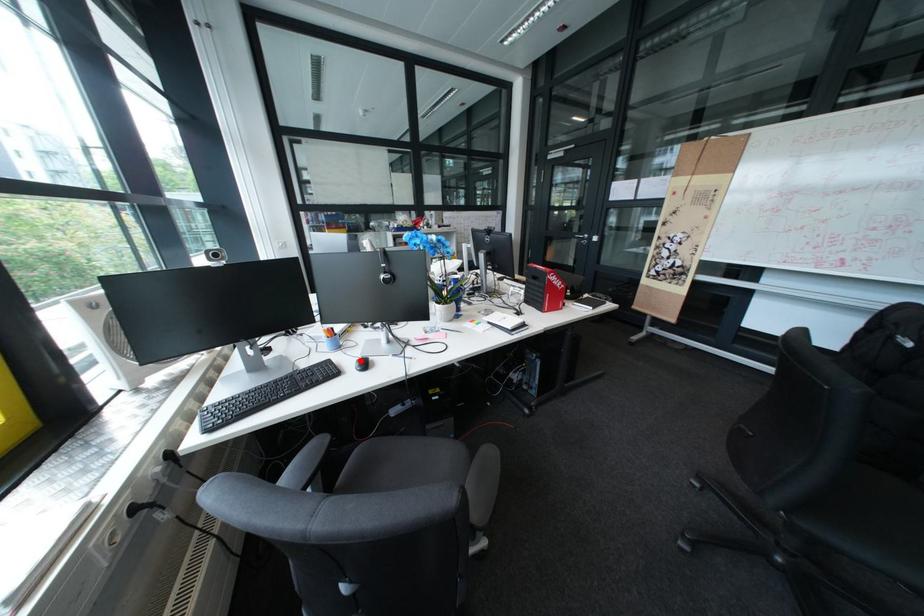
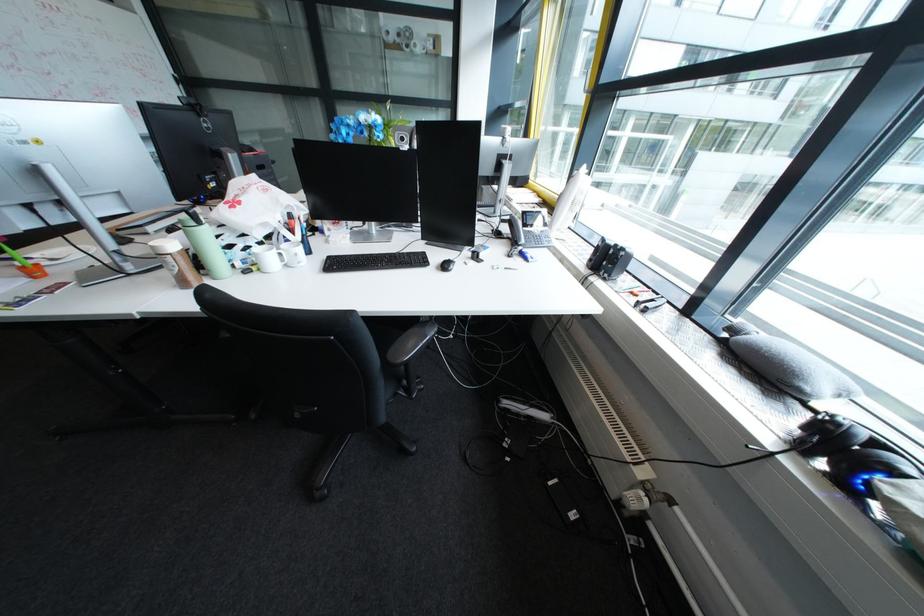
Question: I am providing you with two images of the same scene from different viewpoints. A red point is marked on the first image. At the location where the point appears in image 1, is it still visible in image 2?

Choices:
 (A) Yes
 (B) No

Answer: (B)